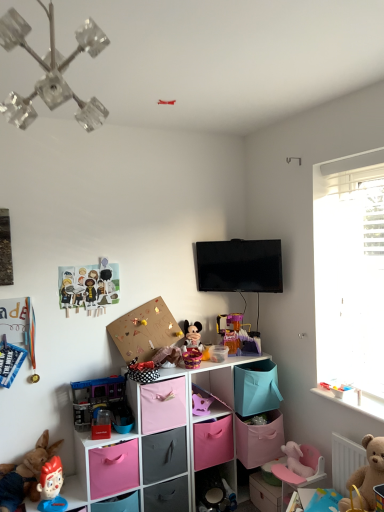
Measure the distance between pink fabric storage at lower center, the first shelf ordered from the bottom, and camera.

pink fabric storage at lower center, the first shelf ordered from the bottom, is 8.51 feet away from camera.

Locate an element on the screen. pink fabric shelf at center, placed as the third shelf when sorted from bottom to top is located at coordinates (207, 403).

The width and height of the screenshot is (384, 512). What do you see at coordinates (238, 332) in the screenshot?
I see `purple plastic castle at center, the third toy in the top-to-bottom sequence` at bounding box center [238, 332].

At what (x,y) coordinates should I click in order to perform the action: click on matte plastic figurine at lower left, the first toy from the bottom. Please return your answer as a coordinate pair (x, y). This screenshot has height=512, width=384. Looking at the image, I should click on (51, 486).

Describe the element at coordinates (51, 486) in the screenshot. I see `matte plastic figurine at lower left, the first toy from the bottom` at that location.

This screenshot has width=384, height=512. I want to click on pink fabric drawer at center, which is the 1th drawer from bottom to top, so click(164, 455).

Is point (102, 109) positioned behind point (377, 464)?

No, (102, 109) is in front of (377, 464).

Does clear crystal chandelier at upper left have a larger size compared to brown plush bear at lower right, the fourth toy when ordered from bottom to top?

Correct, clear crystal chandelier at upper left is larger in size than brown plush bear at lower right, the fourth toy when ordered from bottom to top.

Does clear crystal chandelier at upper left have a greater width compared to brown plush bear at lower right, the seventh toy viewed from the top?

Yes, clear crystal chandelier at upper left is wider than brown plush bear at lower right, the seventh toy viewed from the top.

From the clear crystal chandelier at upper left, count 1st toys backward and point to it. Please provide its 2D coordinates.

[(369, 472)]

Is plastic toy figure at lower left, marked as the eighth toy in a top-to-bottom arrangement, facing towards clear crystal chandelier at upper left?

No.

Is plastic toy figure at lower left, which is the third toy from bottom to top, at the right side of clear crystal chandelier at upper left?

No.

Considering the sizes of objects plastic toy figure at lower left, marked as the eighth toy in a top-to-bottom arrangement, and clear crystal chandelier at upper left in the image provided, who is smaller, plastic toy figure at lower left, marked as the eighth toy in a top-to-bottom arrangement, or clear crystal chandelier at upper left?

Smaller between the two is clear crystal chandelier at upper left.

In the scene shown: From the image's perspective, is brown plush bear at lower right, the fourth toy when ordered from bottom to top, located above or below pink fabric plush at lower right, which is the second toy in bottom-to-top order?

Based on their image positions, brown plush bear at lower right, the fourth toy when ordered from bottom to top, is located above pink fabric plush at lower right, which is the second toy in bottom-to-top order.

Which object is further away from the camera taking this photo, brown plush bear at lower right, the fourth toy when ordered from bottom to top, or pink fabric plush at lower right, which is the second toy in bottom-to-top order?

pink fabric plush at lower right, which is the second toy in bottom-to-top order, is behind.

Is pink fabric plush at lower right, which is the second toy in bottom-to-top order, a part of brown plush bear at lower right, the fourth toy when ordered from bottom to top?

No, brown plush bear at lower right, the fourth toy when ordered from bottom to top, does not contain pink fabric plush at lower right, which is the second toy in bottom-to-top order.

Is brown plush bear at lower right, the fourth toy when ordered from bottom to top, oriented away from pink fabric plush at lower right, which is the 9th toy in top-to-bottom order?

No, brown plush bear at lower right, the fourth toy when ordered from bottom to top,'s orientation is not away from pink fabric plush at lower right, which is the 9th toy in top-to-bottom order.

Is cardboard paper dolls at upper left, the ninth toy positioned from the bottom, with cardboard at upper center?

No, cardboard paper dolls at upper left, the ninth toy positioned from the bottom, is not next to cardboard at upper center.

Is point (114, 273) closer to viewer compared to point (135, 342)?

No, (114, 273) is further to viewer.

Based on their positions, is cardboard paper dolls at upper left, the ninth toy positioned from the bottom, located to the left or right of cardboard at upper center?

In the image, cardboard paper dolls at upper left, the ninth toy positioned from the bottom, appears on the left side of cardboard at upper center.

In the scene shown: Between cardboard paper dolls at upper left, the ninth toy positioned from the bottom, and cardboard at upper center, which one has more height?

cardboard at upper center.

At what (x,y) coordinates should I click in order to perform the action: click on cardboard box behind the pink fabric plush at lower right, which is the 9th toy in top-to-bottom order. Please return your answer as a coordinate pair (x, y). The height and width of the screenshot is (512, 384). Looking at the image, I should click on (145, 331).

Who is taller, pink fabric plush at lower right, which is the second toy in bottom-to-top order, or cardboard at upper center?

cardboard at upper center is taller.

Is pink fabric plush at lower right, which is the 9th toy in top-to-bottom order, placed right next to cardboard at upper center?

pink fabric plush at lower right, which is the 9th toy in top-to-bottom order, and cardboard at upper center are clearly separated.

Is pink fabric plush at lower right, which is the 9th toy in top-to-bottom order, positioned with its back to cardboard at upper center?

That's not correct — pink fabric plush at lower right, which is the 9th toy in top-to-bottom order, is not looking away from cardboard at upper center.

Does pink fabric shelf at center, which is the first shelf in top-to-bottom order, have a greater width compared to clear crystal chandelier at upper left?

Yes.

Is pink fabric shelf at center, which is the first shelf in top-to-bottom order, to the right of clear crystal chandelier at upper left from the viewer's perspective?

Indeed, pink fabric shelf at center, which is the first shelf in top-to-bottom order, is positioned on the right side of clear crystal chandelier at upper left.

Is pink fabric shelf at center, which is the first shelf in top-to-bottom order, in front of or behind clear crystal chandelier at upper left in the image?

Visually, pink fabric shelf at center, which is the first shelf in top-to-bottom order, is located behind clear crystal chandelier at upper left.

How much distance is there between pink fabric shelf at center, placed as the third shelf when sorted from bottom to top, and clear crystal chandelier at upper left?

A distance of 6.56 feet exists between pink fabric shelf at center, placed as the third shelf when sorted from bottom to top, and clear crystal chandelier at upper left.

Is point (146, 406) closer to viewer compared to point (92, 499)?

No, (146, 406) is further to viewer.

From the image's perspective, count 2nd drawers upward from the pink fabric storage box at lower left, acting as the first storage box starting from the left, and point to it. Please provide its 2D coordinates.

[(163, 405)]

Is pink fabric drawer at center, placed as the 1th drawer when sorted from top to bottom, wider than pink fabric storage box at lower left, which is counted as the second storage box, starting from the right?

Yes, pink fabric drawer at center, placed as the 1th drawer when sorted from top to bottom, is wider than pink fabric storage box at lower left, which is counted as the second storage box, starting from the right.

Do you think pink fabric drawer at center, the second drawer positioned from the bottom, is within pink fabric storage box at lower left, acting as the first storage box starting from the left, or outside of it?

pink fabric drawer at center, the second drawer positioned from the bottom, exists outside the volume of pink fabric storage box at lower left, acting as the first storage box starting from the left.

From the clear crystal chandelier at upper left, count 5th toy to the right and point to it. Please provide its 2D coordinates.

[(369, 472)]

I want to click on light fixture in front of the plastic toy figure at lower left, marked as the eighth toy in a top-to-bottom arrangement, so click(51, 71).

From the image, which object appears to be nearer to matte plastic figurine at lower left, the first toy from the bottom, pink fabric drawer at center, placed as the 1th drawer when sorted from top to bottom, or pink fabric storage at lower center, acting as the third shelf starting from the top?

Among the two, pink fabric drawer at center, placed as the 1th drawer when sorted from top to bottom, is located nearer to matte plastic figurine at lower left, the first toy from the bottom.

Based on their spatial positions, is pink fabric drawer at center, placed as the 1th drawer when sorted from top to bottom, or brown plush bear at lower right, the fourth toy when ordered from bottom to top, closer to matte plastic figurine at lower left, the first toy from the bottom?

Among the two, pink fabric drawer at center, placed as the 1th drawer when sorted from top to bottom, is located nearer to matte plastic figurine at lower left, the first toy from the bottom.

Based on the photo, considering their positions, is pink fabric storage at lower center, the first shelf ordered from the bottom, positioned closer to cardboard at upper center than pink fabric drawer at center, the second drawer positioned from the bottom?

Based on the image, pink fabric drawer at center, the second drawer positioned from the bottom, appears to be nearer to cardboard at upper center.

When comparing their distances from plastic blue toy car at center, placed as the 6th toy when sorted from top to bottom, does flat screen tv at upper center or plastic toy figure at lower left, marked as the eighth toy in a top-to-bottom arrangement, seem closer?

plastic toy figure at lower left, marked as the eighth toy in a top-to-bottom arrangement, lies closer to plastic blue toy car at center, placed as the 6th toy when sorted from top to bottom, than the other object.

Looking at the image, which one is located closer to pink fabric storage box at lower left, which is counted as the second storage box, starting from the right, pink fabric shelf at center, which is the first shelf in top-to-bottom order, or brown plush bear at lower right, the seventh toy viewed from the top?

pink fabric shelf at center, which is the first shelf in top-to-bottom order, is closer to pink fabric storage box at lower left, which is counted as the second storage box, starting from the right.

Based on their spatial positions, is pink fabric shelf at center, which is the first shelf in top-to-bottom order, or plastic blue toy car at center, placed as the 6th toy when sorted from top to bottom, closer to flat screen tv at upper center?

Among the two, pink fabric shelf at center, which is the first shelf in top-to-bottom order, is located nearer to flat screen tv at upper center.

Estimate the real-world distances between objects in this image. Which object is further from clear crystal chandelier at upper left, plastic blue toy car at center, marked as the fifth toy in a bottom-to-top arrangement, or pink fabric plush at lower right, which is the second toy in bottom-to-top order?

pink fabric plush at lower right, which is the second toy in bottom-to-top order, is further to clear crystal chandelier at upper left.

Which object lies nearer to the anchor point pink fabric storage at lower center, acting as the third shelf starting from the top, purple plastic castle at center, the third toy in the top-to-bottom sequence, or plastic blue toy car at center, placed as the 6th toy when sorted from top to bottom?

Based on the image, plastic blue toy car at center, placed as the 6th toy when sorted from top to bottom, appears to be nearer to pink fabric storage at lower center, acting as the third shelf starting from the top.

Where is `cardboard box located between plastic toy figure at lower left, which is the third toy from bottom to top, and pink fabric drawer at center, the second drawer positioned from the bottom, in the left-right direction`? cardboard box located between plastic toy figure at lower left, which is the third toy from bottom to top, and pink fabric drawer at center, the second drawer positioned from the bottom, in the left-right direction is located at coordinates (145, 331).

I want to click on cardboard box between plastic blue toy car at center, placed as the 6th toy when sorted from top to bottom, and flat screen tv at upper center from left to right, so click(x=145, y=331).

Find the location of a particular element. shelf between flat screen tv at upper center and brown plush bear at lower right, the fourth toy when ordered from bottom to top, from top to bottom is located at coordinates (207, 403).

This screenshot has width=384, height=512. What are the coordinates of `storage box between clear crystal chandelier at upper left and pink fabric plush at lower right, which is the 9th toy in top-to-bottom order, in the vertical direction` in the screenshot? It's located at (113, 469).